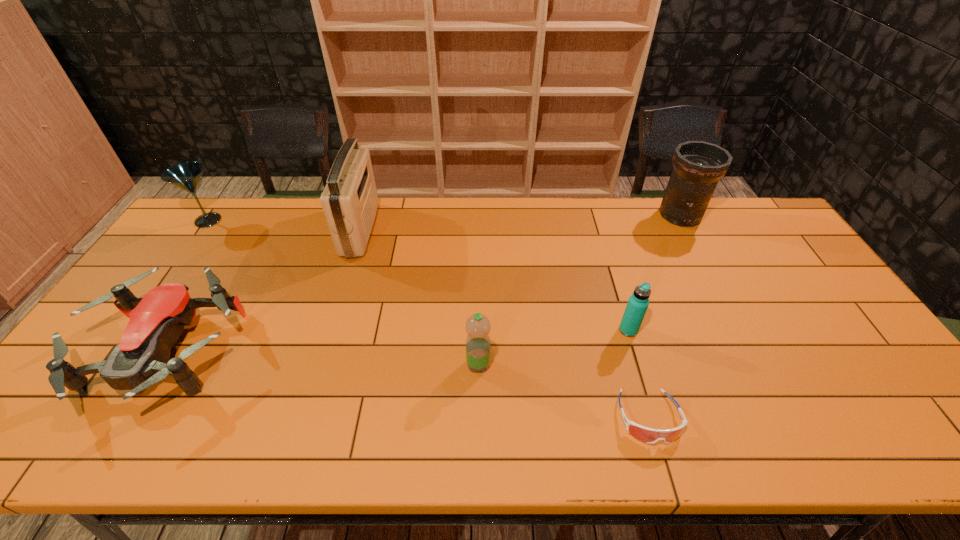
You are a GUI agent. You are given a task and a screenshot of the screen. Output one action in this format:
    pyautogui.click(x=<x>, y=<y>)
    Task: Click on the vacant area that lies between the farther water bottle and the nearer water bottle
    Image resolution: width=960 pixels, height=540 pixels.
    Given the screenshot: What is the action you would take?
    pyautogui.click(x=553, y=347)

At what (x,y) coordinates should I click in order to perform the action: click on vacant space that's between the second tallest object and the farther water bottle. Please return your answer as a coordinate pair (x, y). Looking at the image, I should click on (654, 273).

Locate an element on the screen. Image resolution: width=960 pixels, height=540 pixels. free space between the third object from left to right and the martini is located at coordinates (284, 225).

What are the coordinates of `free spot between the martini and the rightmost object` in the screenshot? It's located at (444, 218).

In order to click on vacant region between the martini and the telephoto lens in this screenshot , I will do `click(444, 218)`.

The width and height of the screenshot is (960, 540). I want to click on object that can be found as the third closest to the shortest object, so click(x=697, y=165).

Where is `object identified as the sixth closest to the farther water bottle`? The image size is (960, 540). object identified as the sixth closest to the farther water bottle is located at coordinates (186, 175).

Image resolution: width=960 pixels, height=540 pixels. What are the coordinates of `free space that satisfies the following two spatial constraints: 1. on the camera side of the drone; 2. on the right side of the left water bottle` in the screenshot? It's located at (158, 364).

Where is `vacant region that satisfies the following two spatial constraints: 1. on the front-facing side of the radio receiver; 2. on the right side of the farther water bottle`? This screenshot has width=960, height=540. vacant region that satisfies the following two spatial constraints: 1. on the front-facing side of the radio receiver; 2. on the right side of the farther water bottle is located at coordinates (329, 330).